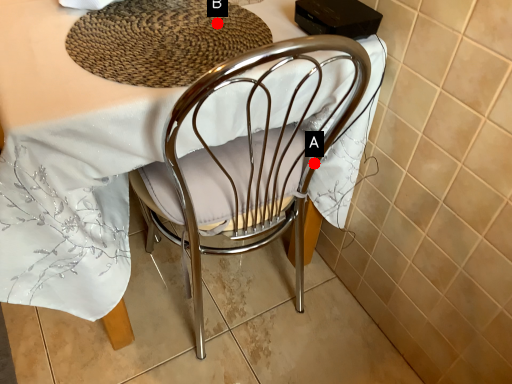
Question: Two points are circled on the image, labeled by A and B beside each circle. Which point is farther from the camera taking this photo?

Choices:
 (A) A is further
 (B) B is further

Answer: (A)